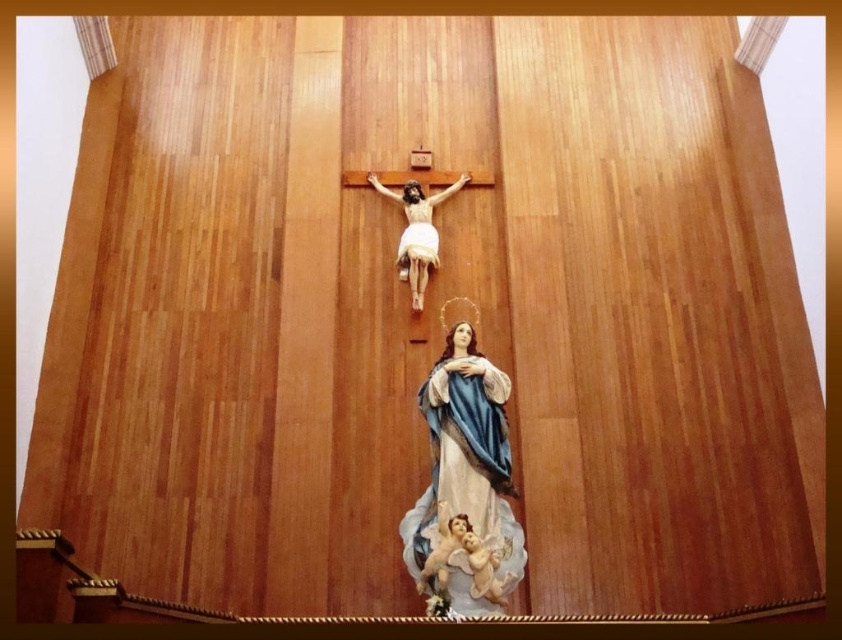
You are an architect designing a new church and want to place a crucifix in the exact center of the wall. The wall has a coordinate system where the bottom left corner is the origin point. The current crucifix is placed at point (417, 232). Is the crucifix centered on the wall?

The matte white figure at center is located at point (417, 232), which is the exact center of the wall, so yes, the crucifix is centered on the wall.

In the scene shown: You are an art conservator examining the wooden wall in a religious setting. You notice a point at coordinates (465, 484) on the wall. Based on the scene description, what object is located at this point?

The point at coordinates (465, 484) corresponds to the polychrome painted statue at center.

You are an art restorer assessing the wooden wall. You need to place a protective cover over both the matte white figure at center and the smooth beige cherub at lower center. Given their sizes, which object requires a larger cover?

The matte white figure at center requires a larger cover because its width is greater than the smooth beige cherub at lower center.